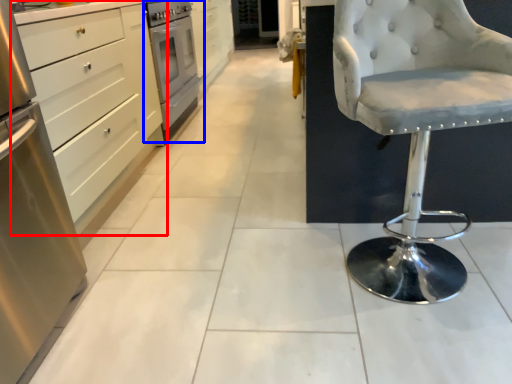
Question: Which of the following is the farthest to the observer, cabinetry (highlighted by a red box) or home appliance (highlighted by a blue box)?

Choices:
 (A) cabinetry
 (B) home appliance

Answer: (B)